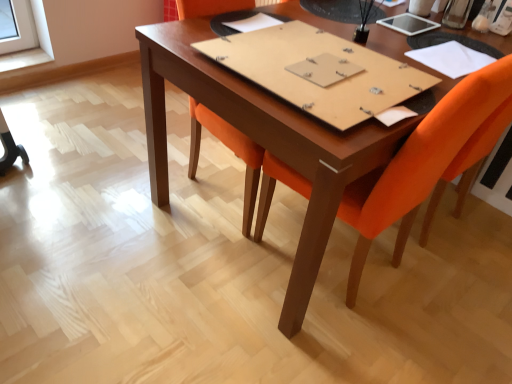
The height and width of the screenshot is (384, 512). Identify the location of vacant space in front of orange fabric chair at center. (340, 349).